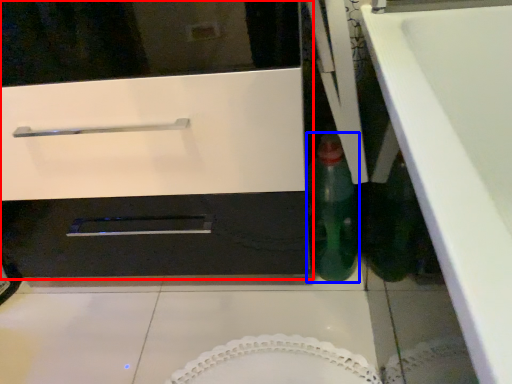
Question: Which object appears closest to the camera in this image, oven (highlighted by a red box) or bottle (highlighted by a blue box)?

Choices:
 (A) oven
 (B) bottle

Answer: (A)